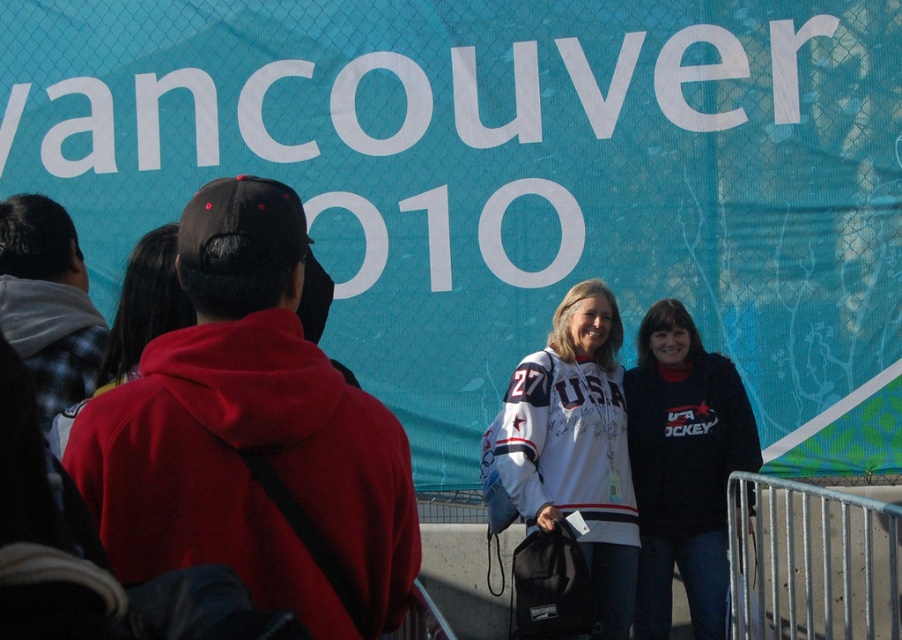
Locate an element on the screen. The image size is (902, 640). red fleece sweatshirt at left is located at coordinates (203, 449).

Find the location of a particular element. The image size is (902, 640). red fleece sweatshirt at left is located at coordinates (203, 449).

Based on the photo, is white jersey at center below black fleece sweatshirt at center?

No.

Measure the distance from white jersey at center to black fleece sweatshirt at center.

They are 24.79 inches apart.

Who is more forward, (626, 525) or (682, 420)?

Positioned in front is point (626, 525).

Identify the location of white jersey at center. (576, 448).

Between red fleece sweatshirt at left and white jersey at center, which one is positioned lower?

white jersey at center is lower down.

Which of these two, red fleece sweatshirt at left or white jersey at center, stands taller?

white jersey at center is taller.

Locate an element on the screen. This screenshot has width=902, height=640. red fleece sweatshirt at left is located at coordinates (203, 449).